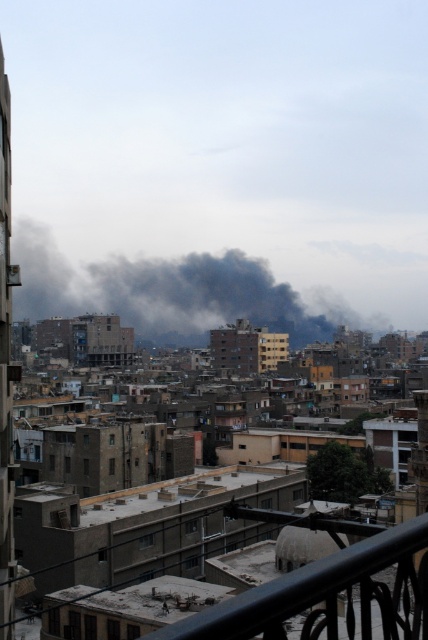
Image resolution: width=428 pixels, height=640 pixels. Describe the element at coordinates (171, 292) in the screenshot. I see `black smoke at center` at that location.

Between black smoke at center and black metal railing at lower right, which one has less height?

black metal railing at lower right is shorter.

I want to click on black smoke at center, so click(171, 292).